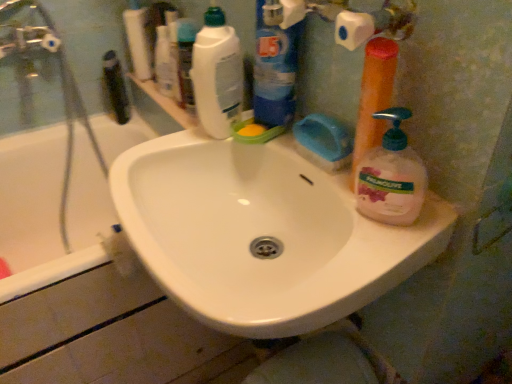
The image size is (512, 384). In order to click on free space to the left of black plastic toothbrush at left, the 1th toiletry when ordered from back to front in this screenshot , I will do `click(81, 123)`.